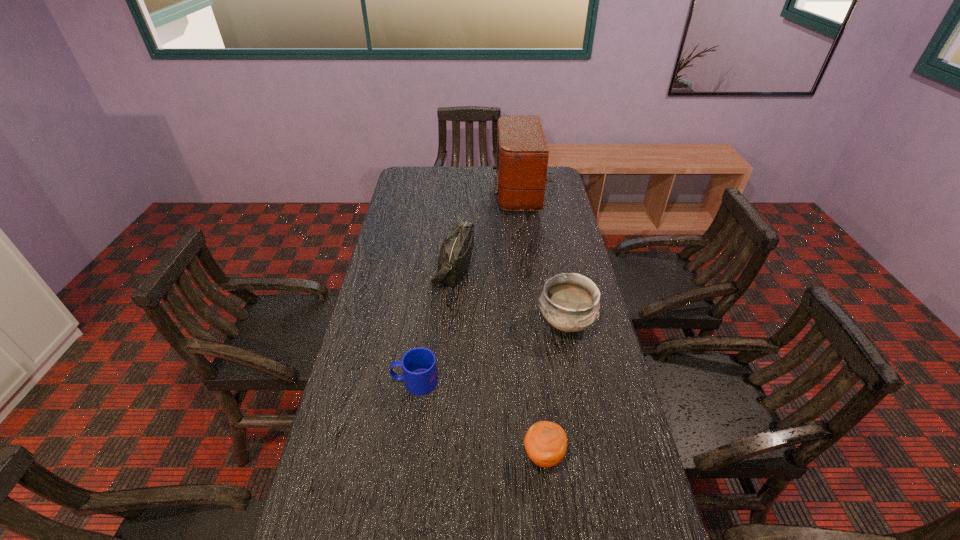
Locate an element on the screen. The height and width of the screenshot is (540, 960). the farthest object is located at coordinates (522, 152).

Find the location of `the tallest object`. the tallest object is located at coordinates (522, 152).

Identify the location of the fourth nearest object. (455, 254).

Where is `the second tallest object`? The width and height of the screenshot is (960, 540). the second tallest object is located at coordinates (455, 254).

Identify the location of the third farthest object. The image size is (960, 540). [569, 301].

Find the location of a particular element. the third tallest object is located at coordinates (569, 301).

Identify the location of orange. (545, 442).

At what (x,y) coordinates should I click in order to perform the action: click on the shortest object. Please return your answer as a coordinate pair (x, y). Looking at the image, I should click on (418, 364).

This screenshot has height=540, width=960. What are the coordinates of `mug` in the screenshot? It's located at (418, 364).

Find the location of `vacant area situated 0.080m on the front panel of the radio receiver`. vacant area situated 0.080m on the front panel of the radio receiver is located at coordinates (475, 193).